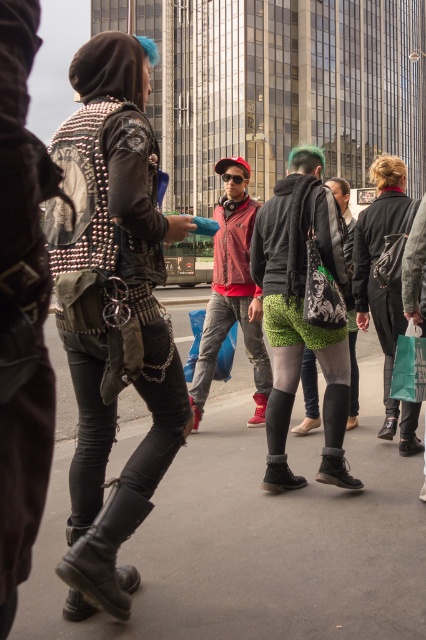
Who is higher up, green matte shopping bag at lower right or blue plastic bag at center?

blue plastic bag at center is higher up.

Can you confirm if green matte shopping bag at lower right is positioned above blue plastic bag at center?

Incorrect, green matte shopping bag at lower right is not positioned above blue plastic bag at center.

Find the location of a particular element. The width and height of the screenshot is (426, 640). green matte shopping bag at lower right is located at coordinates (409, 365).

Which is behind, point (408, 554) or point (408, 384)?

The point (408, 384) is behind.

Who is more distant from viewer, (207,506) or (420,355)?

Positioned behind is point (420,355).

I want to click on gray asphalt pavement at center, so click(256, 540).

Based on the photo, is studded leather jacket at left to the left of green textured shorts at center from the viewer's perspective?

Indeed, studded leather jacket at left is positioned on the left side of green textured shorts at center.

Between studded leather jacket at left and green textured shorts at center, which one is positioned higher?

green textured shorts at center is above.

At what (x,y) coordinates should I click in order to perform the action: click on studded leather jacket at left. Please return your answer as a coordinate pair (x, y). This screenshot has width=426, height=640. Looking at the image, I should click on (118, 324).

At what (x,y) coordinates should I click in order to perform the action: click on studded leather jacket at left. Please return your answer as a coordinate pair (x, y). The width and height of the screenshot is (426, 640). Looking at the image, I should click on (118, 324).